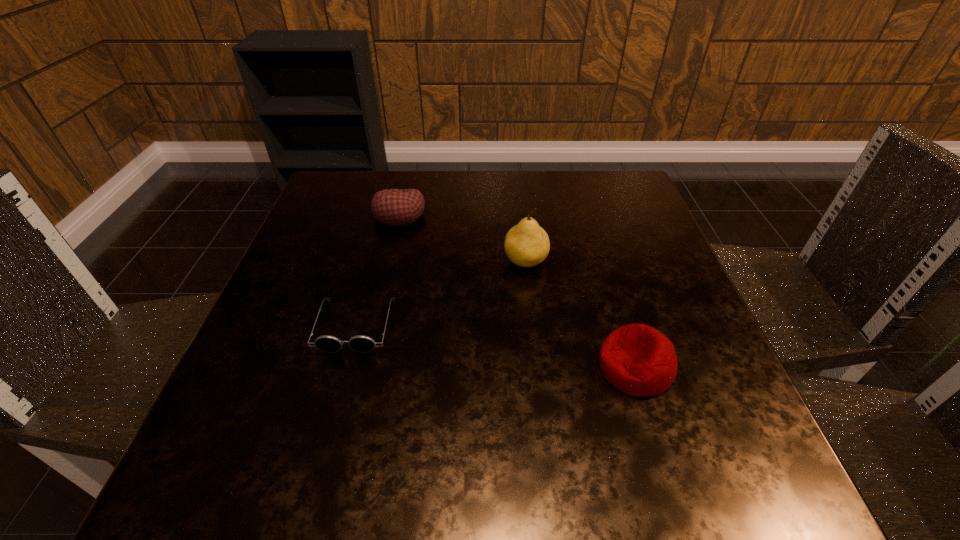
The image size is (960, 540). What are the coordinates of `vacant space located 0.080m on the seat area of the right beanbag` in the screenshot? It's located at (549, 367).

Identify the location of free space located on the seat area of the right beanbag. (538, 367).

This screenshot has width=960, height=540. Find the location of `vacant space located 0.060m on the front-facing side of the shortest object`. vacant space located 0.060m on the front-facing side of the shortest object is located at coordinates (340, 385).

Find the location of a particular element. The height and width of the screenshot is (540, 960). object that is at the far edge is located at coordinates (396, 207).

Locate an element on the screen. beanbag situated at the left edge is located at coordinates (396, 207).

Where is `sunglasses located in the left edge section of the desktop`? Image resolution: width=960 pixels, height=540 pixels. sunglasses located in the left edge section of the desktop is located at coordinates (360, 343).

The image size is (960, 540). Find the location of `object that is at the right edge`. object that is at the right edge is located at coordinates (637, 359).

Find the location of a particular element. object at the far left corner is located at coordinates (396, 207).

This screenshot has width=960, height=540. In the image, there is a desktop. What are the coordinates of `vacant space at the far edge` in the screenshot? It's located at (445, 192).

This screenshot has width=960, height=540. In order to click on blank space at the near edge in this screenshot , I will do `click(304, 495)`.